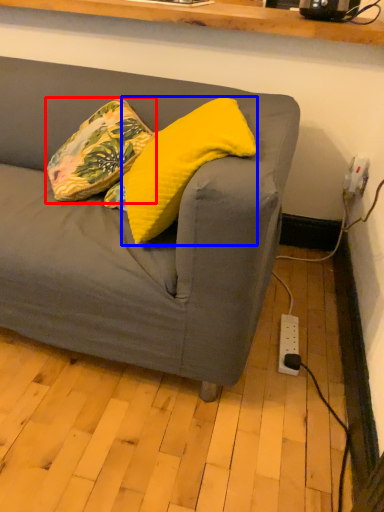
Question: Which point is further to the camera, pillow (highlighted by a red box) or pillow (highlighted by a blue box)?

Choices:
 (A) pillow
 (B) pillow

Answer: (A)